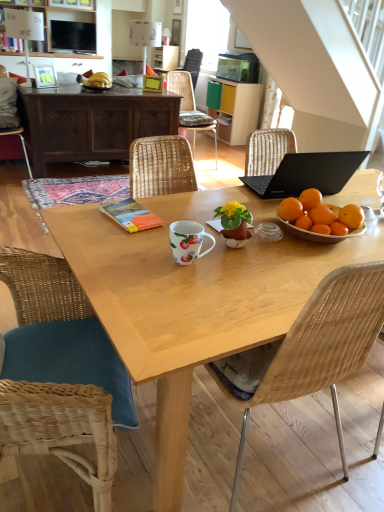
This screenshot has height=512, width=384. In order to click on free spot in front of porcelain floral mug at center in this screenshot , I will do point(191,288).